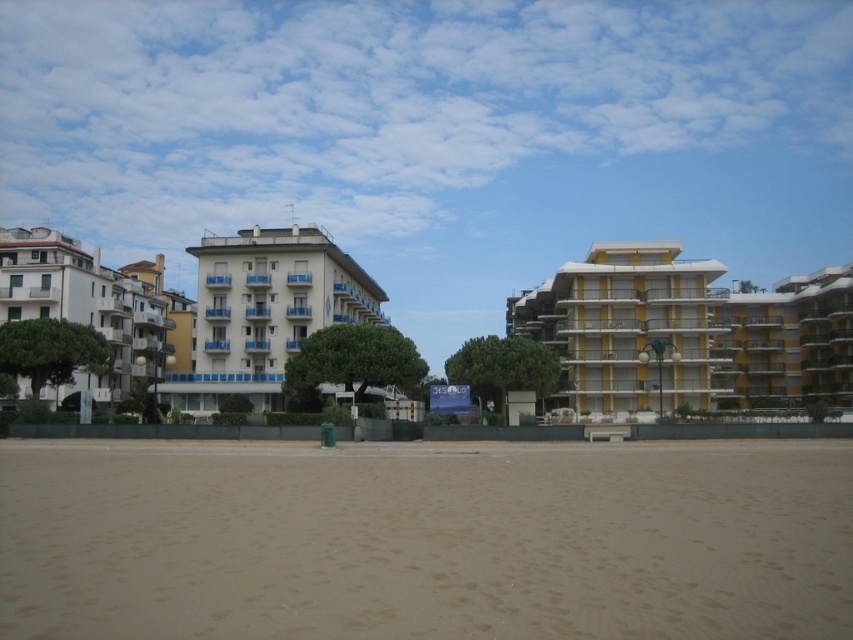
Question: From the image, what is the correct spatial relationship of yellow matte building at right in relation to white matte building at left?

Choices:
 (A) above
 (B) below

Answer: (B)

Question: Which of the following is the closest to the observer?

Choices:
 (A) white matte building at left
 (B) brown sandy beach at lower center
 (C) white glossy building at center

Answer: (B)

Question: Is brown sandy beach at lower center smaller than white glossy building at center?

Choices:
 (A) yes
 (B) no

Answer: (A)

Question: Which object appears farthest from the camera in this image?

Choices:
 (A) white glossy building at center
 (B) white matte building at left
 (C) yellow matte building at right
 (D) brown sandy beach at lower center

Answer: (A)

Question: Does yellow matte building at right have a greater width compared to white glossy building at center?

Choices:
 (A) yes
 (B) no

Answer: (A)

Question: Estimate the real-world distances between objects in this image. Which object is closer to the brown sandy beach at lower center?

Choices:
 (A) white matte building at left
 (B) white glossy building at center

Answer: (A)